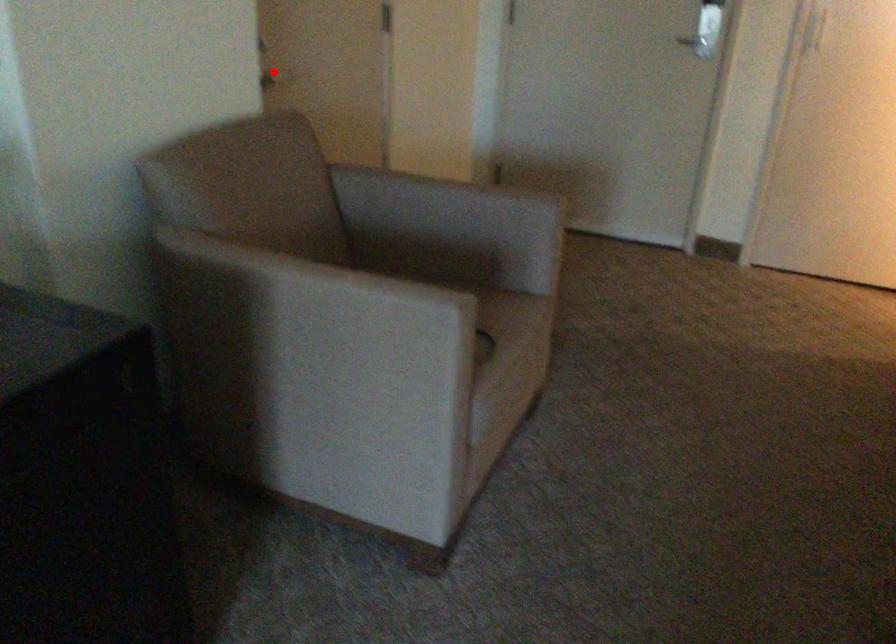
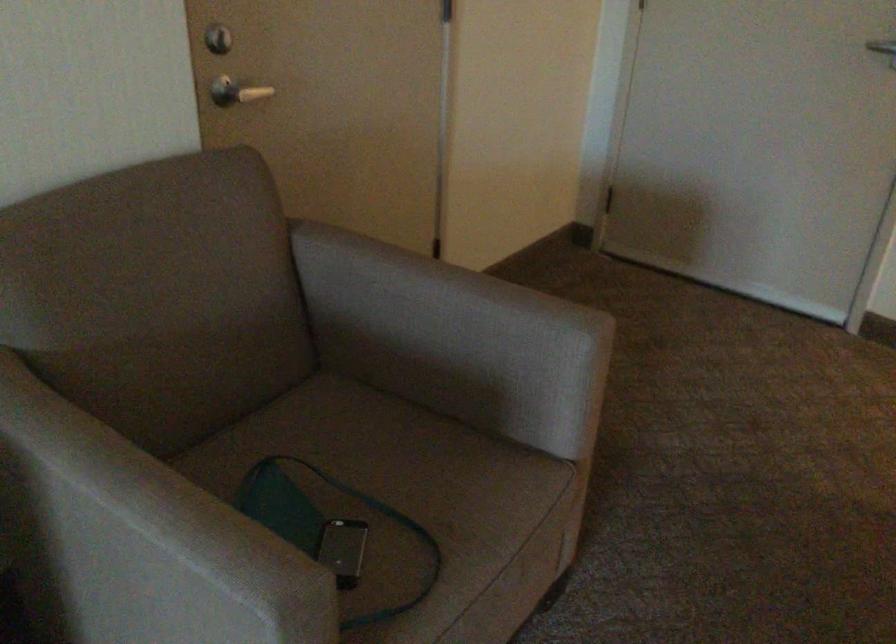
The point at the highlighted location is marked in the first image. Where is the corresponding point in the second image?

(236, 91)